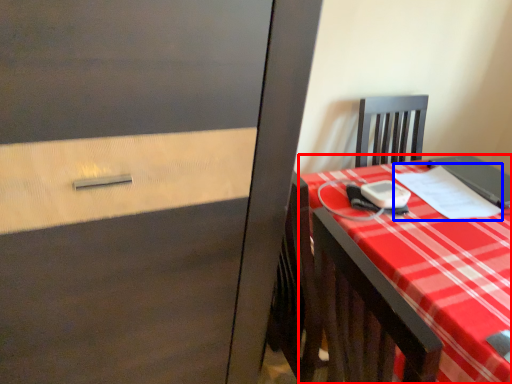
Question: Among these objects, which one is farthest to the camera, desk (highlighted by a red box) or notebook (highlighted by a blue box)?

Choices:
 (A) desk
 (B) notebook

Answer: (B)